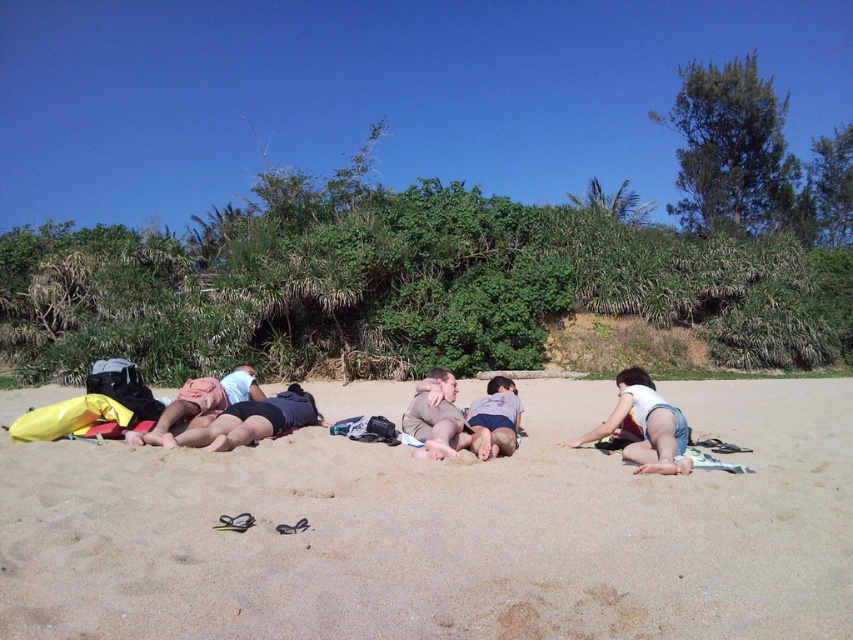
Does beige sandy beach at center have a lesser height compared to dark blue shorts at center?

Correct, beige sandy beach at center is not as tall as dark blue shorts at center.

Does beige sandy beach at center appear on the right side of dark blue shorts at center?

Indeed, beige sandy beach at center is positioned on the right side of dark blue shorts at center.

Between point (50, 451) and point (314, 410), which one is positioned in front?

Point (50, 451)

Where is `beige sandy beach at center`? beige sandy beach at center is located at coordinates (445, 531).

Who is more forward, (x=352, y=545) or (x=183, y=394)?

Point (x=352, y=545) is in front.

Describe the element at coordinates (445, 531) in the screenshot. I see `beige sandy beach at center` at that location.

Image resolution: width=853 pixels, height=640 pixels. Identify the location of beige sandy beach at center. (445, 531).

Is point (578, 420) positioned behind point (403, 413)?

Yes, point (578, 420) is farther from viewer.

Is beige sandy beach at center positioned before brown suede jacket at center?

Yes.

Where is `beige sandy beach at center`? Image resolution: width=853 pixels, height=640 pixels. beige sandy beach at center is located at coordinates (445, 531).

Where is `beige sandy beach at center`? beige sandy beach at center is located at coordinates pyautogui.click(x=445, y=531).